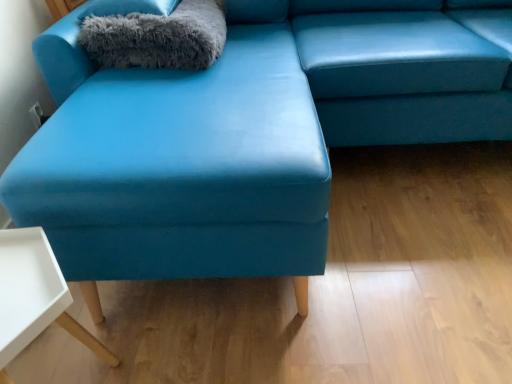
Question: From a real-world perspective, is gray fluffy pillow at upper left physically above gray fluffy blanket at upper left?

Choices:
 (A) no
 (B) yes

Answer: (B)

Question: Is gray fluffy pillow at upper left smaller than gray fluffy blanket at upper left?

Choices:
 (A) no
 (B) yes

Answer: (B)

Question: Is gray fluffy pillow at upper left further to the viewer compared to gray fluffy blanket at upper left?

Choices:
 (A) no
 (B) yes

Answer: (B)

Question: Is gray fluffy pillow at upper left oriented away from gray fluffy blanket at upper left?

Choices:
 (A) no
 (B) yes

Answer: (A)

Question: From a real-world perspective, is gray fluffy pillow at upper left beneath gray fluffy blanket at upper left?

Choices:
 (A) yes
 (B) no

Answer: (B)

Question: Does gray fluffy pillow at upper left have a greater height compared to gray fluffy blanket at upper left?

Choices:
 (A) no
 (B) yes

Answer: (A)

Question: Can you confirm if gray fluffy blanket at upper left is bigger than gray fluffy pillow at upper left?

Choices:
 (A) yes
 (B) no

Answer: (A)

Question: Does gray fluffy blanket at upper left come in front of gray fluffy pillow at upper left?

Choices:
 (A) yes
 (B) no

Answer: (A)

Question: Considering the relative positions of gray fluffy blanket at upper left and gray fluffy pillow at upper left in the image provided, is gray fluffy blanket at upper left to the left of gray fluffy pillow at upper left from the viewer's perspective?

Choices:
 (A) no
 (B) yes

Answer: (A)

Question: From a real-world perspective, is gray fluffy blanket at upper left under gray fluffy pillow at upper left?

Choices:
 (A) yes
 (B) no

Answer: (A)

Question: From the image's perspective, is gray fluffy blanket at upper left located beneath gray fluffy pillow at upper left?

Choices:
 (A) no
 (B) yes

Answer: (B)

Question: Is gray fluffy blanket at upper left shorter than gray fluffy pillow at upper left?

Choices:
 (A) yes
 (B) no

Answer: (B)

Question: From the image's perspective, is gray fluffy pillow at upper left under white matte table at lower left?

Choices:
 (A) no
 (B) yes

Answer: (A)